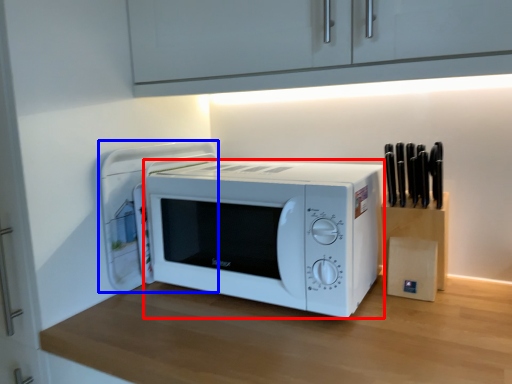
Question: Which point is further to the camera, microwave oven (highlighted by a red box) or appliance (highlighted by a blue box)?

Choices:
 (A) microwave oven
 (B) appliance

Answer: (B)